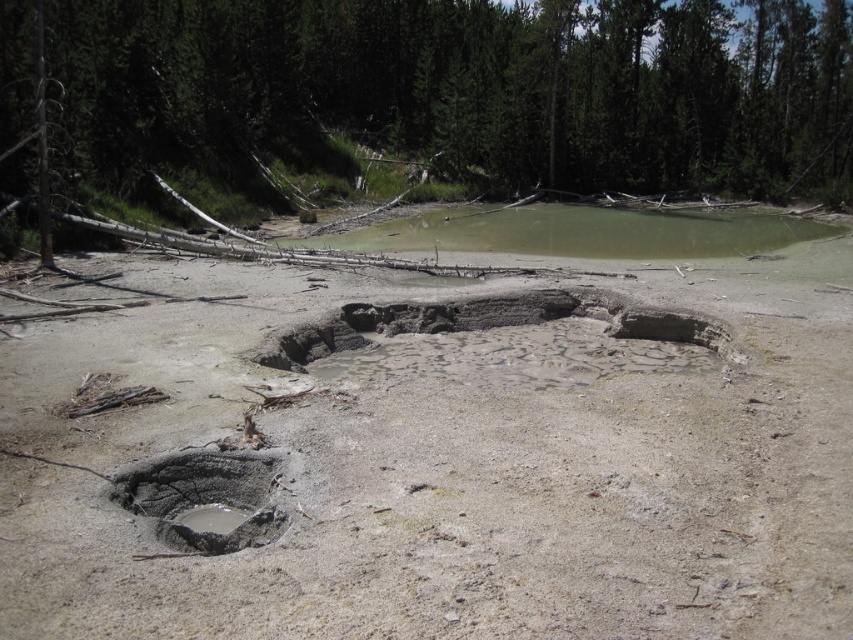
Based on the scene, if you were standing at the muddy clay hole at lower left and wanted to walk towards the green leafy tree at upper center, which direction should you head?

You should head to the right, since the green leafy tree at upper center is to the right of the muddy clay hole at lower left.

From the picture: You are standing at the center of the image and want to take a photo of the green leafy tree at upper center. Which direction should you face to ensure the tree is in the center of your camera view?

The green leafy tree at upper center is located at point (444, 100) in the image, so facing towards the upper center direction will center the tree in your camera view.